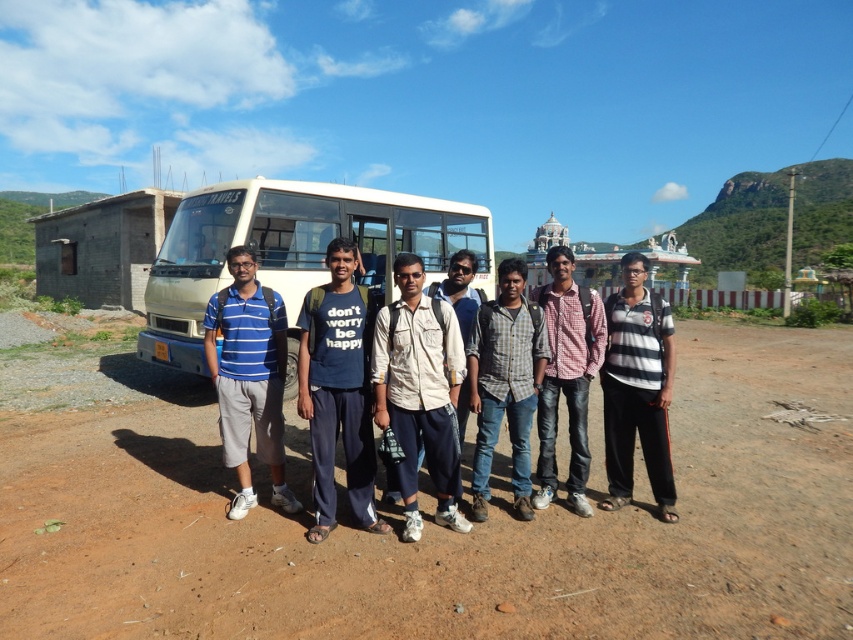
You are a photographer trying to focus on the checkered fabric shirt at center and the checkered shirt at center. Which one is positioned lower in the image?

The checkered fabric shirt at center is positioned lower than the checkered shirt at center.